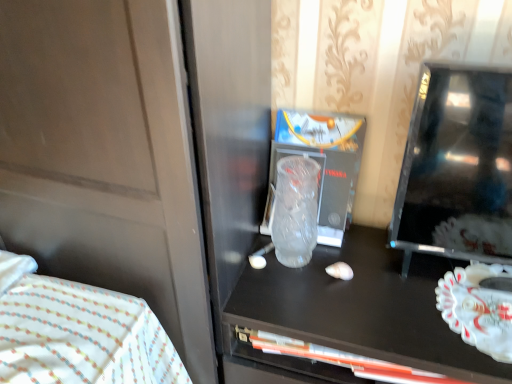
Question: In the image, is white fabric bed at lower left on the left side or the right side of transparent frosted glass at center?

Choices:
 (A) left
 (B) right

Answer: (A)

Question: Is point (138, 337) closer or farther from the camera than point (316, 198)?

Choices:
 (A) closer
 (B) farther

Answer: (A)

Question: Estimate the real-world distances between objects in this image. Which object is farther from the transparent frosted glass at center?

Choices:
 (A) white fabric bed at lower left
 (B) black glossy tv at right
 (C) white glossy plate at right

Answer: (A)

Question: Estimate the real-world distances between objects in this image. Which object is farther from the white glossy plate at right?

Choices:
 (A) white fabric bed at lower left
 (B) black glossy tv at right
 (C) transparent frosted glass at center

Answer: (A)